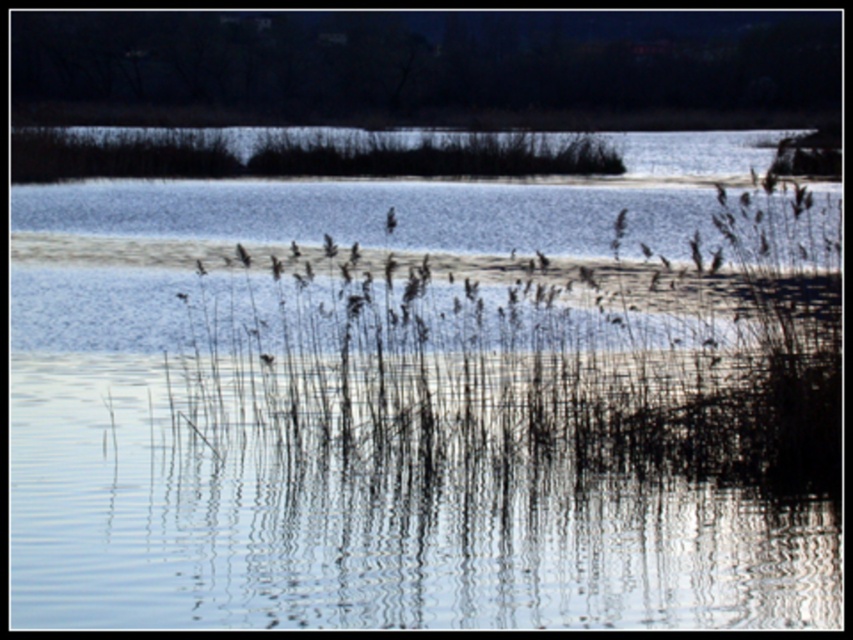
You are a photographer trying to capture the reflection of the reeds in the water. You notice the clear water at center and the brown grass at center. Which object would provide a better reflection surface, and why?

Result: The clear water at center would provide a better reflection surface because it has a smaller size compared to the brown grass at center, allowing for a more focused and detailed reflection of the reeds.

You are a frog sitting on the brown grass at center. To jump into the clear water at center, which direction should you jump?

The clear water at center is located below the brown grass at center, so the frog should jump downward to reach the clear water at center.